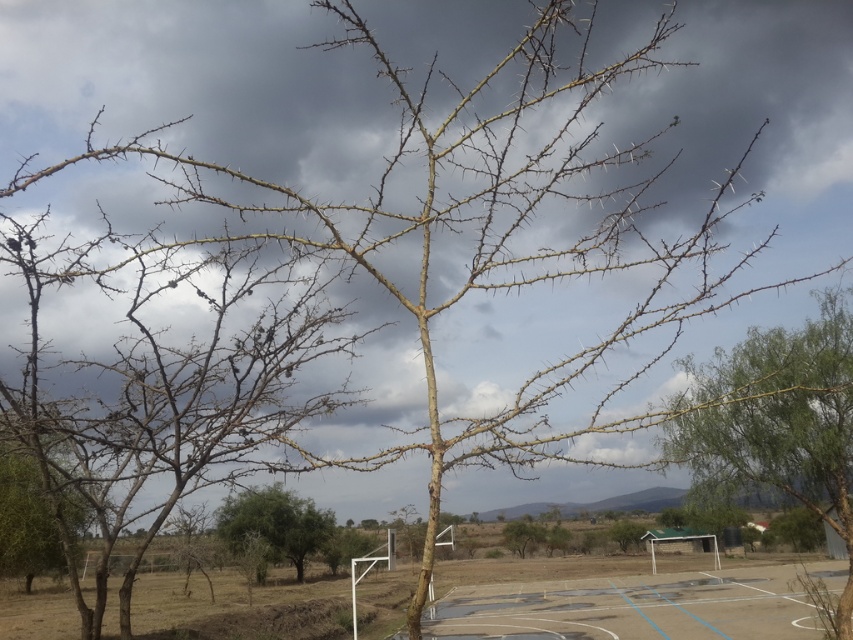
You are planning to install a new basketball hoop on the blue painted concrete basketball court at lower center. Considering the space occupied by the green leafy tree at center, will there be enough room to install the hoop without it being too close to the tree?

The blue painted concrete basketball court at lower center is wider than the green leafy tree at center, so there should be sufficient space to install the hoop without it being too close to the tree.

You are standing on the basketball court and looking towards the trees. Which tree, the brown thorny tree at lower left or the green leafy tree at center, is closer to you?

The brown thorny tree at lower left is closer to you because it is positioned over the green leafy tree at center, meaning it is in front of it from your perspective.

You are standing at the position marked by the coordinates point A at the top left corner of the image. You want to walk directly to the blue painted concrete basketball court at lower center. In which direction should you move relative to your current position?

Since the blue painted concrete basketball court at lower center is located at point (631, 608), you should move downward and to the right from your current position at the top left corner to reach it.